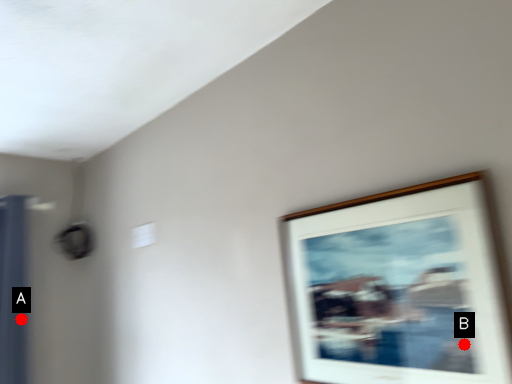
Question: Two points are circled on the image, labeled by A and B beside each circle. Which point appears farthest from the camera in this image?

Choices:
 (A) A is further
 (B) B is further

Answer: (A)